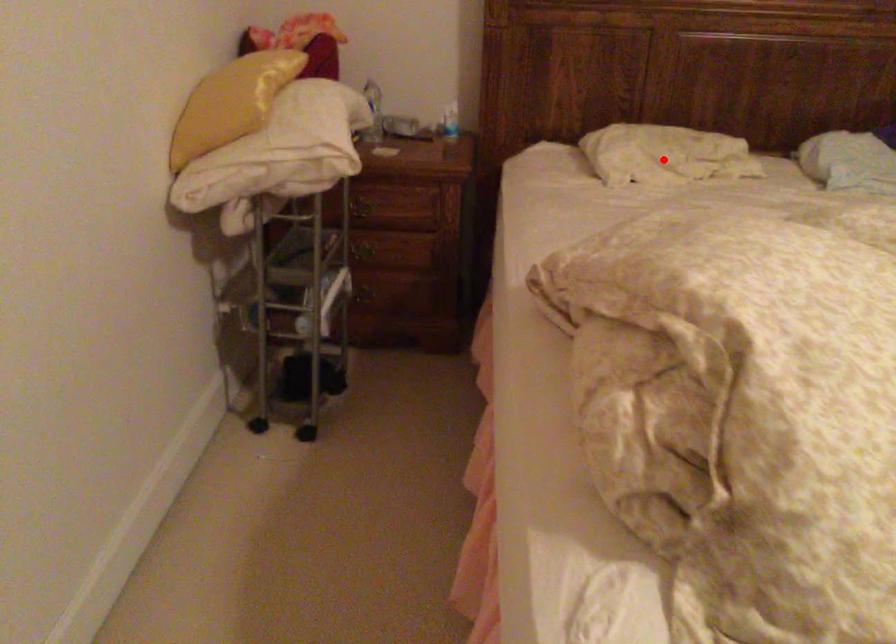
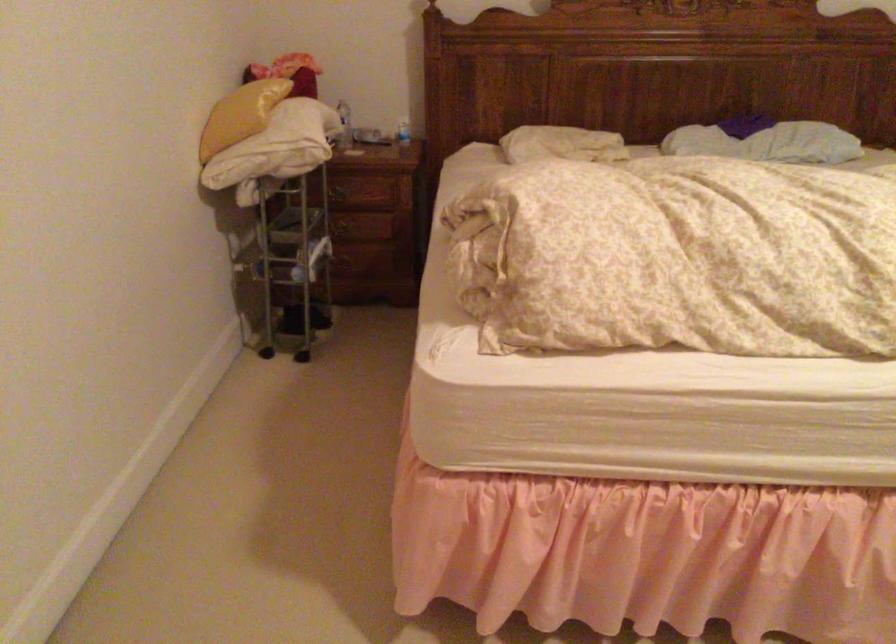
Question: I am providing you with two images of the same scene from different viewpoints. Given a red point in image1, look at the same physical point in image2. Is it:

Choices:
 (A) Closer to the viewpoint
 (B) Farther from the viewpoint

Answer: (B)